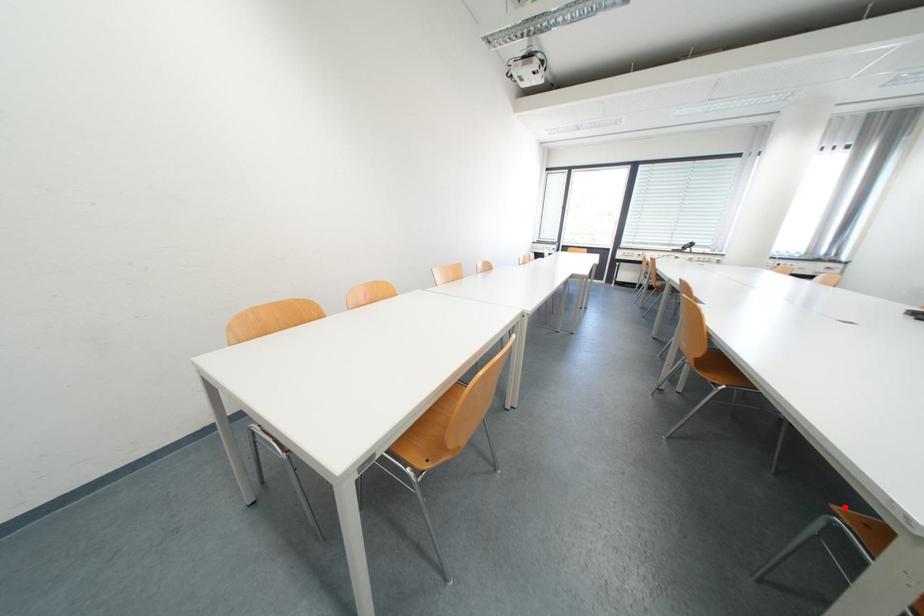
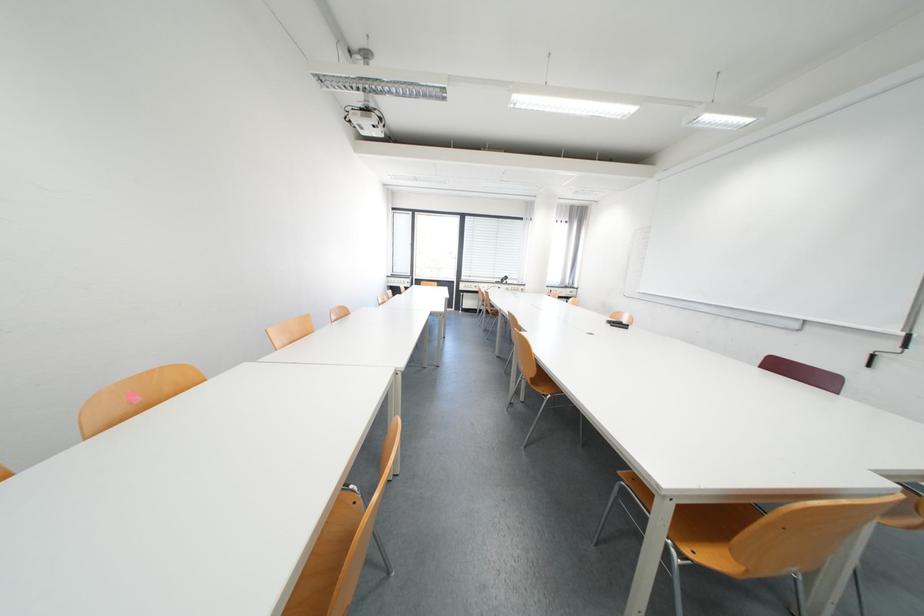
Find the pixel in the second image that matches the highlighted location in the first image.

(629, 474)